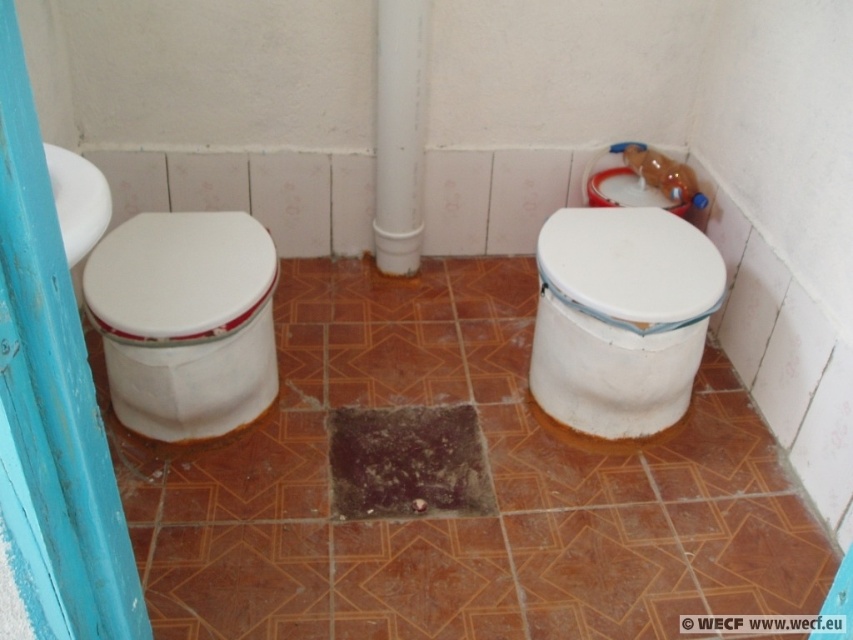
Which of these two, white glossy toilet at right or white glossy toilet lid at right, stands taller?

white glossy toilet at right

Which is behind, point (549, 288) or point (643, 308)?

Point (549, 288)

Find the location of a particular element. white glossy toilet at right is located at coordinates (619, 317).

Is brown tile at center positioned in front of white glossy toilet lid at right?

Yes, brown tile at center is in front of white glossy toilet lid at right.

Identify the location of brown tile at center. (460, 516).

Locate an element on the screen. The image size is (853, 640). brown tile at center is located at coordinates (460, 516).

Find the location of a particular element. blue painted wood door at left is located at coordinates (55, 385).

Can you confirm if blue painted wood door at left is positioned to the right of white glossy toilet at right?

No, blue painted wood door at left is not to the right of white glossy toilet at right.

Who is more forward, (107,522) or (581,248)?

Point (107,522)

Locate an element on the screen. This screenshot has height=640, width=853. blue painted wood door at left is located at coordinates (55, 385).